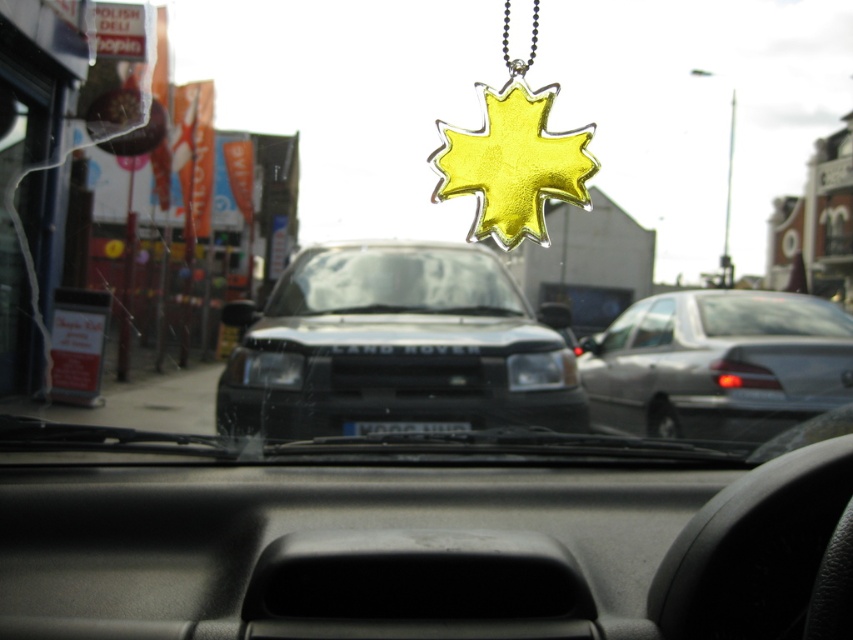
Who is positioned more to the left, silver metallic sedan at right or black plastic license plate at center?

black plastic license plate at center

Who is more distant from viewer, (x=741, y=344) or (x=453, y=420)?

Point (x=741, y=344)

Who is more forward, [830,394] or [467,422]?

Point [830,394] is in front.

At what (x,y) coordinates should I click in order to perform the action: click on silver metallic sedan at right. Please return your answer as a coordinate pair (x, y). Image resolution: width=853 pixels, height=640 pixels. Looking at the image, I should click on (718, 364).

Which is below, clear glass car window at center or black plastic license plate at center?

Positioned lower is black plastic license plate at center.

Is point (740, 324) closer to viewer compared to point (409, 428)?

That is False.

This screenshot has height=640, width=853. In order to click on clear glass car window at center in this screenshot , I will do `click(770, 316)`.

Does point (650, 356) come in front of point (757, 324)?

No, it is behind (757, 324).

Does silver metallic sedan at right come behind clear glass car window at center?

No.

Is point (699, 326) positioned before point (784, 300)?

Yes, it is in front of point (784, 300).

Identify the location of silver metallic sedan at right. (718, 364).